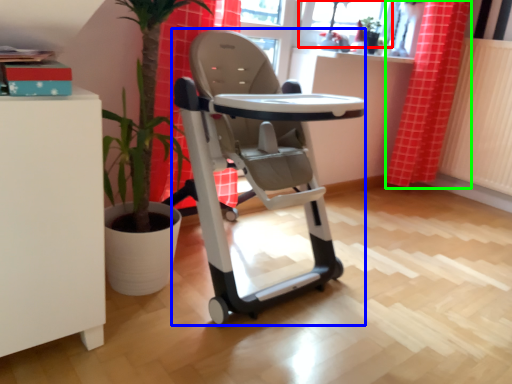
Question: Which is nearer to the window screen (highlighted by a red box)? baby carriage (highlighted by a blue box) or curtain (highlighted by a green box).

Choices:
 (A) baby carriage
 (B) curtain

Answer: (B)